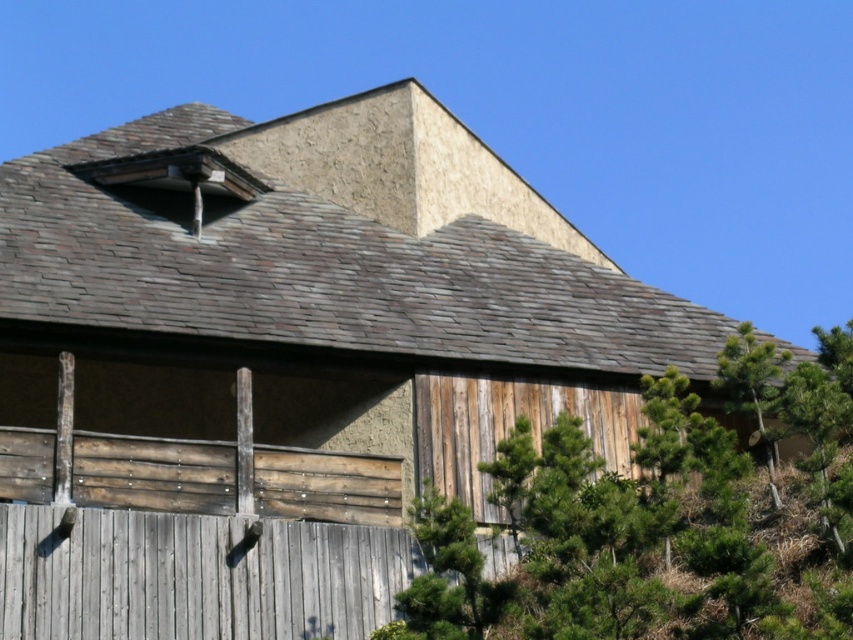
Can you confirm if green leafy tree at center is shorter than green textured pine tree at right?

No.

Is green leafy tree at center to the right of green textured pine tree at right from the viewer's perspective?

No, green leafy tree at center is not to the right of green textured pine tree at right.

Between point (567, 484) and point (759, 420), which one is positioned in front?

Point (567, 484) is more forward.

The height and width of the screenshot is (640, 853). I want to click on green leafy tree at center, so tap(657, 520).